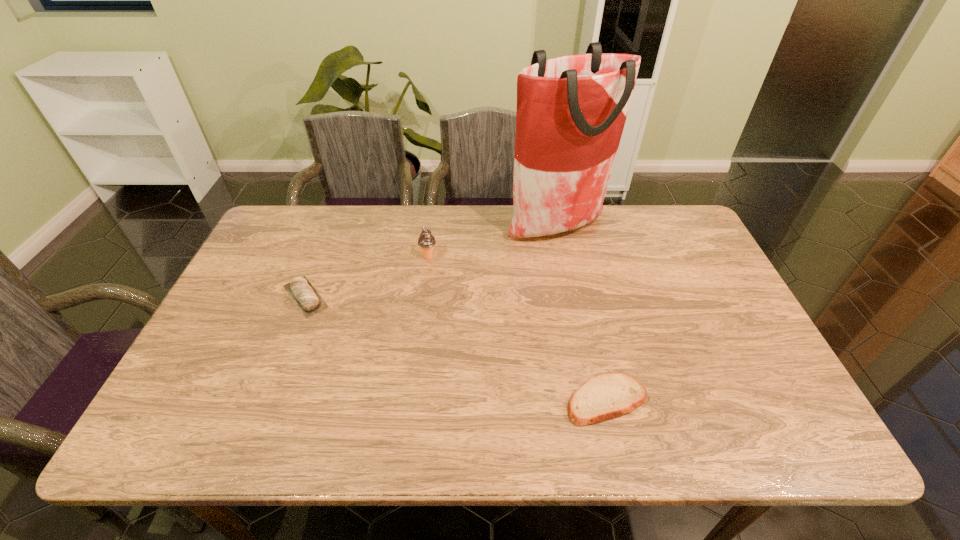
At what (x,y) coordinates should I click in order to perform the action: click on grocery bag. Please return your answer as a coordinate pair (x, y). Image resolution: width=960 pixels, height=540 pixels. Looking at the image, I should click on (571, 111).

Image resolution: width=960 pixels, height=540 pixels. I want to click on the third object from right to left, so click(426, 241).

Identify the location of icecream. (426, 241).

Where is `the farther pita bread`? the farther pita bread is located at coordinates (307, 299).

The height and width of the screenshot is (540, 960). I want to click on the left pita bread, so click(x=307, y=299).

Locate an element on the screen. The image size is (960, 540). the nearer pita bread is located at coordinates (609, 395).

Where is `the shorter pita bread`? The width and height of the screenshot is (960, 540). the shorter pita bread is located at coordinates 609,395.

Locate an element on the screen. free location located on the right of the tallest object is located at coordinates (684, 227).

Where is `vacant position located 0.060m on the left of the second object from left to right`? The image size is (960, 540). vacant position located 0.060m on the left of the second object from left to right is located at coordinates (400, 256).

This screenshot has height=540, width=960. Identify the location of vacant position located on the right of the farther pita bread. (457, 296).